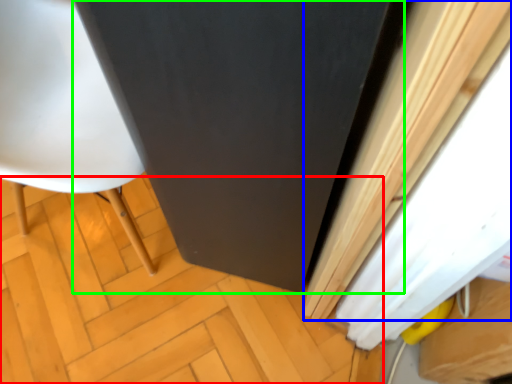
Question: Which is nearer to the plywood (highlighted by a red box)? curtain (highlighted by a blue box) or screen door (highlighted by a green box).

Choices:
 (A) curtain
 (B) screen door

Answer: (B)